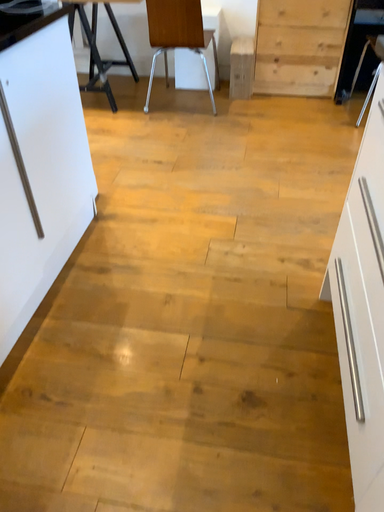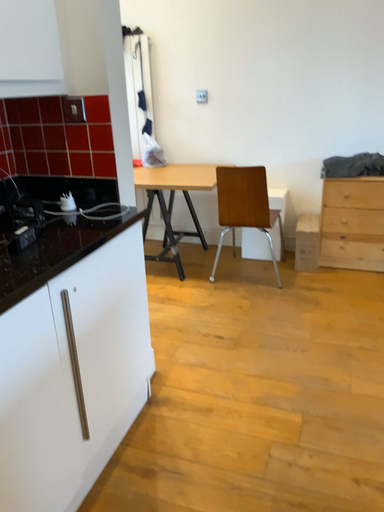
Question: How did the camera likely rotate when shooting the video?

Choices:
 (A) rotated downward
 (B) rotated upward

Answer: (B)